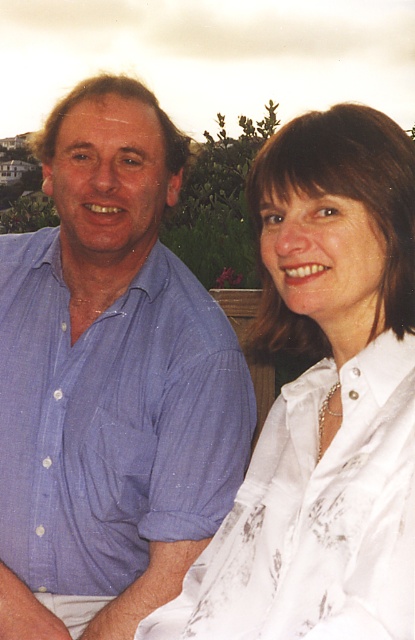
You are standing 20 feet away from the point marked at coordinates point (144, 611). Can you reach the point without moving closer than 20 feet?

The distance of point (144, 611) from viewer is 25.72 feet, so you are currently 20 feet away and cannot reach it without moving closer than 20 feet.

You are a photographer setting up for a portrait shoot. You need to position a spotlight so that it illuminates both the blue cotton shirt at left and the white satin blouse at upper right equally. Given their positions, where should you place the spotlight relative to the subjects?

→ The blue cotton shirt at left is located above the white satin blouse at upper right. To illuminate both equally, the spotlight should be placed above and slightly to the right of the subjects so that the light can reach both the higher position of the blue cotton shirt at left and the lower position of the white satin blouse at upper right effectively.

You are a photographer trying to capture a group photo of the blue cotton shirt at left and the white satin blouse at upper right. Since you want both to appear equally sized in the photo, which direction should you move your camera? Explain your reasoning.

The blue cotton shirt at left is smaller than the white satin blouse at upper right. To make them appear the same size in the photo, you should move the camera closer to the blue cotton shirt at left and farther from the white satin blouse at upper right. This adjustment balances their sizes in the frame.